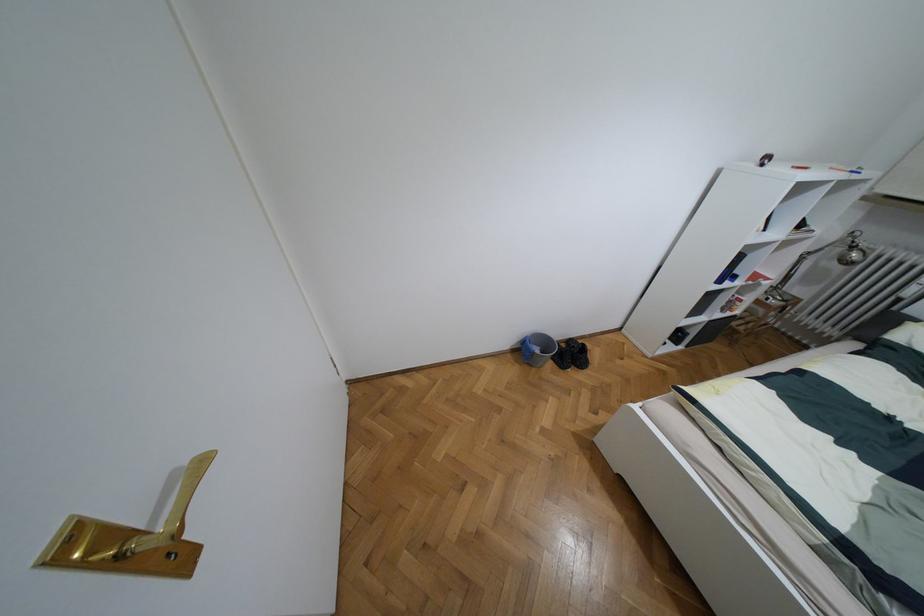
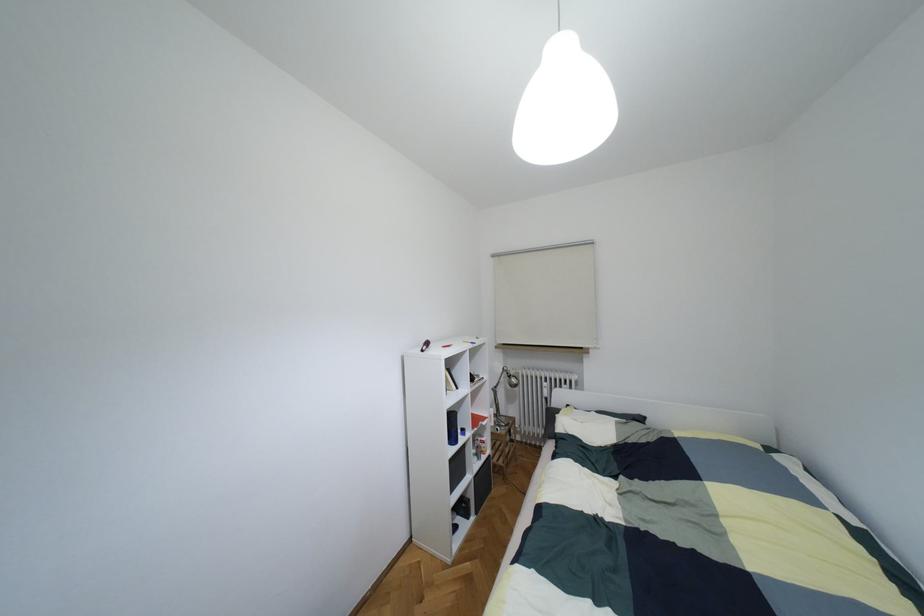
Where in the second image is the point corresponding to (x=676, y=334) from the first image?

(460, 508)